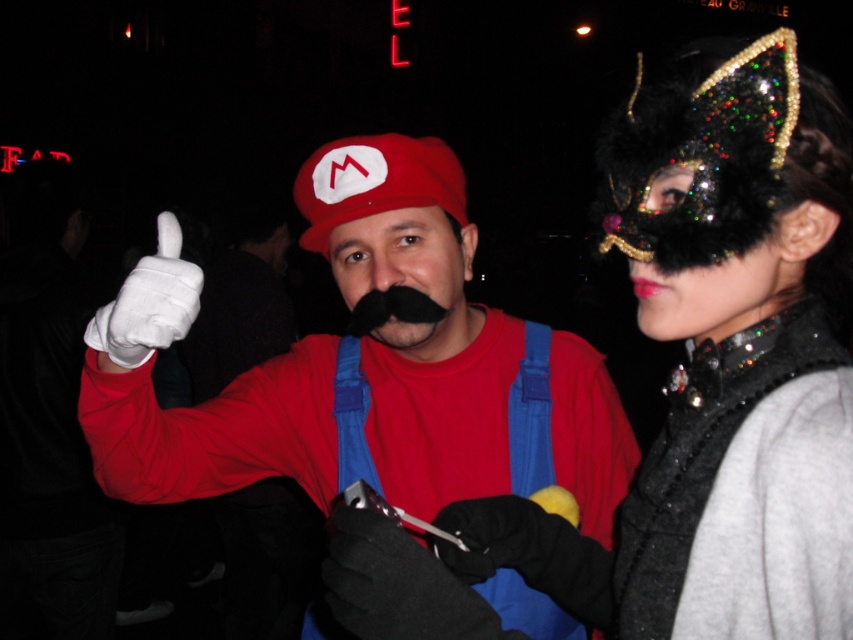
Question: Among these objects, which one is farthest from the camera?

Choices:
 (A) black fuzzy mustache at center
 (B) matte red cap at center
 (C) black leather gloves at center
 (D) white cotton glove at center

Answer: (A)

Question: Does matte red cap at center have a lesser width compared to white cotton glove at center?

Choices:
 (A) no
 (B) yes

Answer: (A)

Question: Where is black leather gloves at center located in relation to white cotton glove at center in the image?

Choices:
 (A) right
 (B) left

Answer: (A)

Question: Among these points, which one is nearest to the camera?

Choices:
 (A) (171, 323)
 (B) (300, 388)
 (C) (483, 605)
 (D) (381, 298)

Answer: (C)

Question: Is matte red cap at center below white cotton glove at center?

Choices:
 (A) yes
 (B) no

Answer: (A)

Question: Which point is farther to the camera?

Choices:
 (A) black fuzzy mustache at center
 (B) white cotton glove at center

Answer: (A)